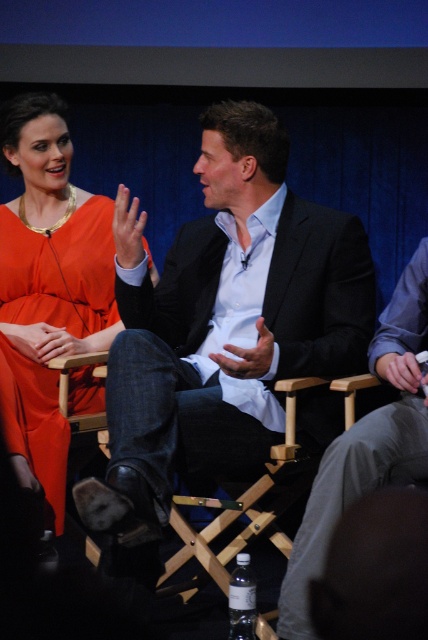
Question: Among these points, which one is nearest to the camera?

Choices:
 (A) (53, 458)
 (B) (211, 269)

Answer: (A)

Question: Is matte black suit at center to the right of dark gray suit at center from the viewer's perspective?

Choices:
 (A) no
 (B) yes

Answer: (A)

Question: Which object is farther from the camera taking this photo?

Choices:
 (A) dark gray suit at center
 (B) matte black suit at center
 (C) matte orange dress at upper left

Answer: (C)

Question: Which point appears closest to the camera in this image?

Choices:
 (A) (244, 339)
 (B) (377, 440)

Answer: (B)

Question: Observing the image, what is the correct spatial positioning of matte orange dress at upper left in reference to dark gray suit at center?

Choices:
 (A) above
 (B) below

Answer: (A)

Question: Is matte black suit at center wider than matte orange dress at upper left?

Choices:
 (A) yes
 (B) no

Answer: (A)